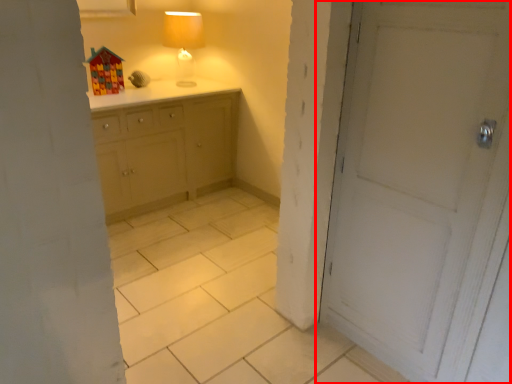
Question: Where is door (annotated by the red box) located in relation to table lamp in the image?

Choices:
 (A) left
 (B) right

Answer: (B)